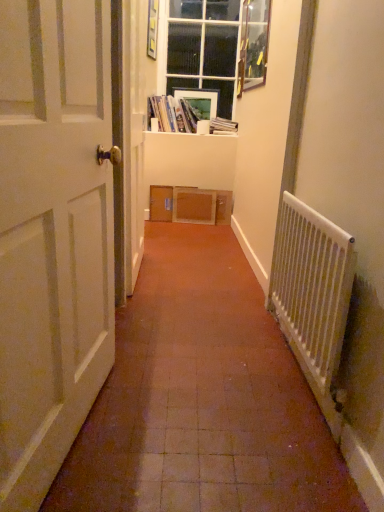
Question: Is wooden picture frame at upper right, acting as the 2th picture frame starting from the left, closer to camera compared to matte plastic picture frame at upper center, arranged as the 2th picture frame when viewed from the front?

Choices:
 (A) yes
 (B) no

Answer: (A)

Question: Does wooden picture frame at upper right, the first picture frame from the front, appear on the left side of matte plastic picture frame at upper center, the second picture frame in the right-to-left sequence?

Choices:
 (A) yes
 (B) no

Answer: (B)

Question: Considering the relative sizes of wooden picture frame at upper right, acting as the 2th picture frame starting from the left, and matte plastic picture frame at upper center, arranged as the 2th picture frame when viewed from the front, in the image provided, is wooden picture frame at upper right, acting as the 2th picture frame starting from the left, thinner than matte plastic picture frame at upper center, arranged as the 2th picture frame when viewed from the front,?

Choices:
 (A) no
 (B) yes

Answer: (A)

Question: Can you confirm if wooden picture frame at upper right, the first picture frame viewed from the right, is taller than matte plastic picture frame at upper center, the first picture frame positioned from the left?

Choices:
 (A) yes
 (B) no

Answer: (A)

Question: From the image's perspective, is wooden picture frame at upper right, acting as the 2th picture frame starting from the left, above matte plastic picture frame at upper center, arranged as the 2th picture frame when viewed from the front?

Choices:
 (A) no
 (B) yes

Answer: (B)

Question: From their relative heights in the image, would you say clear glass window at upper center is taller or shorter than white matte door at left?

Choices:
 (A) tall
 (B) short

Answer: (B)

Question: From the image's perspective, relative to white matte door at left, is clear glass window at upper center above or below?

Choices:
 (A) above
 (B) below

Answer: (A)

Question: From a real-world perspective, relative to white matte door at left, is clear glass window at upper center vertically above or below?

Choices:
 (A) below
 (B) above

Answer: (B)

Question: Considering their positions, is clear glass window at upper center located in front of or behind white matte door at left?

Choices:
 (A) behind
 (B) front

Answer: (A)

Question: Is matte cardboard books at upper center, placed as the 2th book when sorted from right to left, in front of or behind clear glass window at upper center in the image?

Choices:
 (A) front
 (B) behind

Answer: (A)

Question: Is point (175, 99) positioned closer to the camera than point (187, 74)?

Choices:
 (A) closer
 (B) farther

Answer: (A)

Question: Considering the positions of matte cardboard books at upper center, placed as the 2th book when sorted from right to left, and clear glass window at upper center in the image, is matte cardboard books at upper center, placed as the 2th book when sorted from right to left, wider or thinner than clear glass window at upper center?

Choices:
 (A) wide
 (B) thin

Answer: (A)

Question: From a real-world perspective, relative to clear glass window at upper center, is matte cardboard books at upper center, acting as the 1th book starting from the left, vertically above or below?

Choices:
 (A) above
 (B) below

Answer: (B)

Question: Looking at their shapes, would you say matte plastic picture frame at upper center, the first picture frame positioned from the left, is wider or thinner than white matte door at left?

Choices:
 (A) wide
 (B) thin

Answer: (B)

Question: Considering their positions, is matte plastic picture frame at upper center, the first picture frame positioned from the left, located in front of or behind white matte door at left?

Choices:
 (A) front
 (B) behind

Answer: (B)